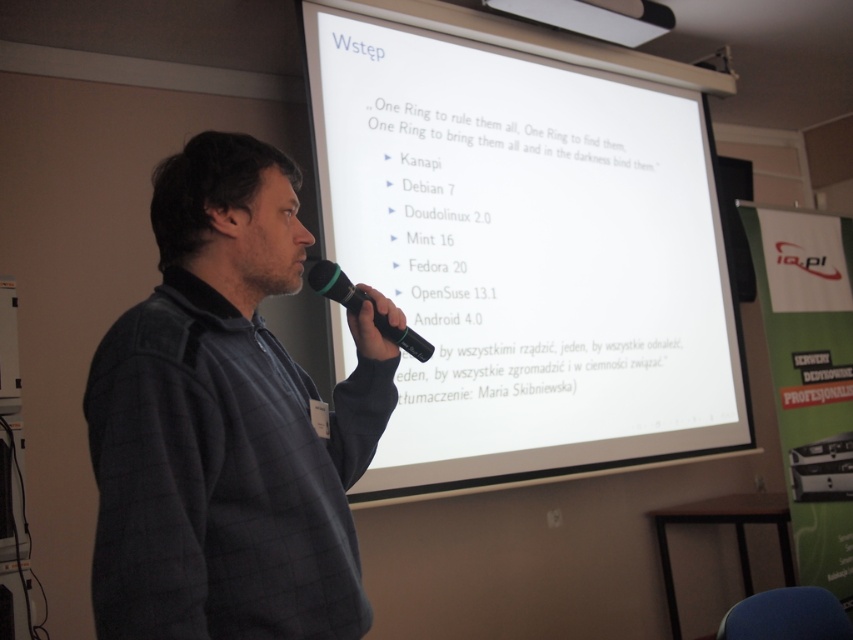
You are organizing an event and need to ensure that the presenter can be seen clearly by the audience. Considering the dark gray sweater at center and the black rubber microphone at center, which object is bigger and might draw more attention?

The dark gray sweater at center has a larger size compared to the black rubber microphone at center, so it might draw more attention.

You are an attendee at a tech conference and you want to take a photo of the white matte projection screen at upper center to share on social media. The screen is located at point 0.395, 0.615. If you are standing directly in front of the speaker, which direction should you move to capture the entire screen in your phone camera?

Since the white matte projection screen at upper center is located at point (524, 252), you should move slightly to your left to ensure the entire screen is in frame when taking the photo.